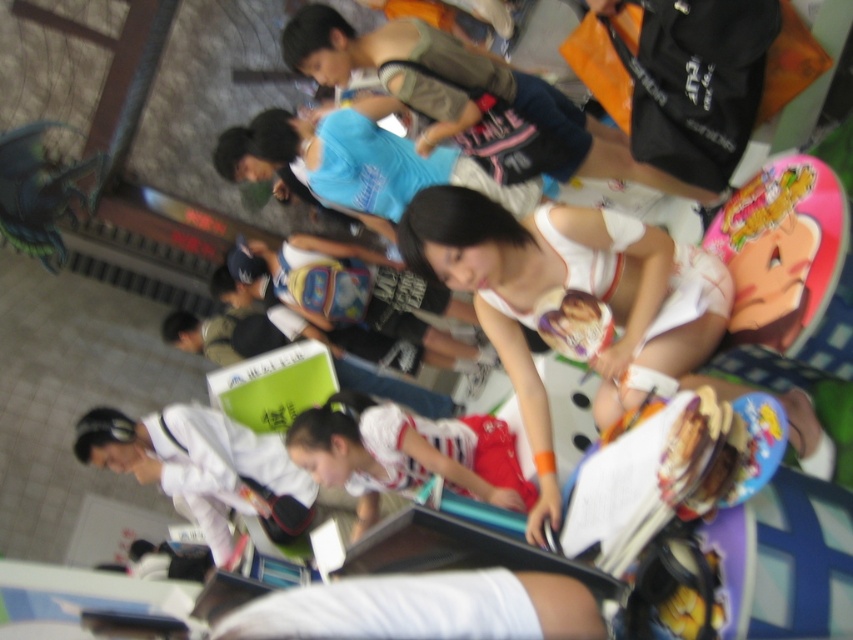
Does point (664, 371) come farther from viewer compared to point (373, 429)?

No, it is in front of (373, 429).

Between point (656, 291) and point (462, 422), which one is positioned in front?

Point (656, 291) is more forward.

Who is more distant from viewer, (412, 243) or (409, 477)?

Point (409, 477)

Locate an element on the screen. The width and height of the screenshot is (853, 640). white fabric tank top at center is located at coordinates (576, 289).